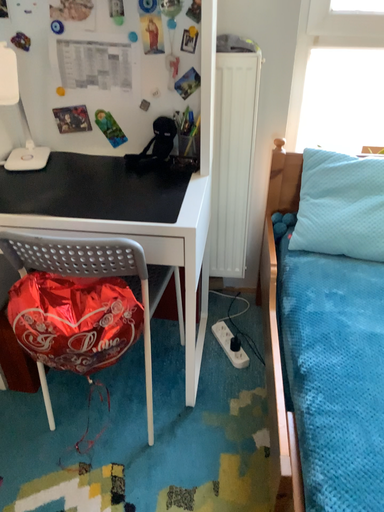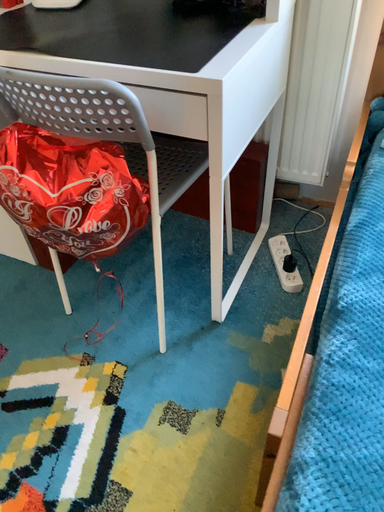
Question: Which way did the camera rotate in the video?

Choices:
 (A) rotated downward
 (B) rotated upward

Answer: (A)